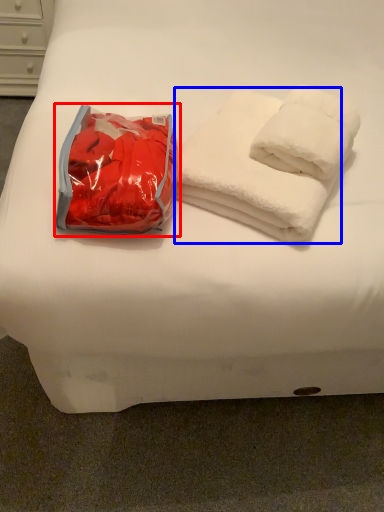
Question: Which of the following is the closest to the observer, bean bag chair (highlighted by a red box) or towel (highlighted by a blue box)?

Choices:
 (A) bean bag chair
 (B) towel

Answer: (A)